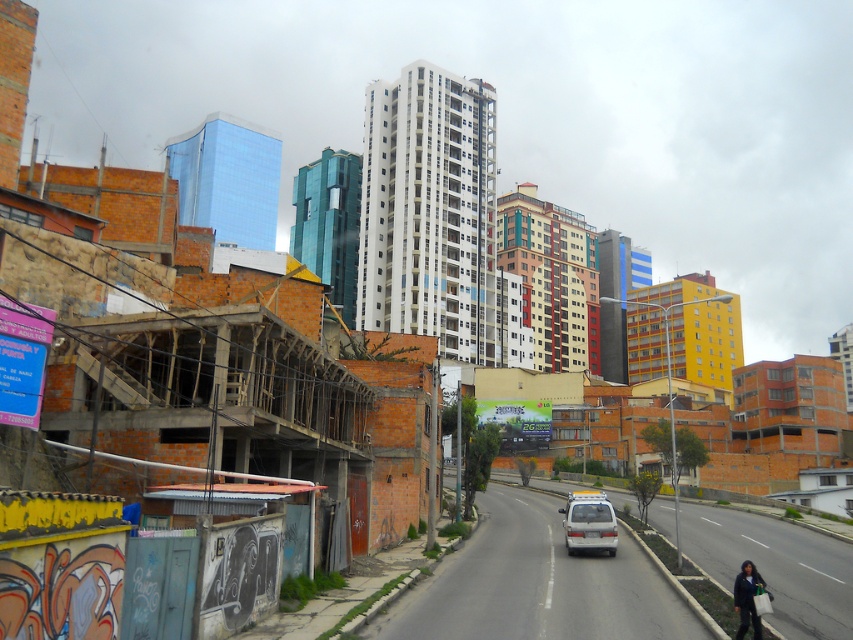
Question: Which point is closer to the camera taking this photo?

Choices:
 (A) (625, 547)
 (B) (747, 620)
 (C) (573, 548)

Answer: (B)

Question: Is white matte van at center above dark blue jacket at lower right?

Choices:
 (A) no
 (B) yes

Answer: (A)

Question: Which of the following is the closest to the observer?

Choices:
 (A) white matte van at center
 (B) dark blue jacket at lower right
 (C) gray asphalt road at center

Answer: (B)

Question: Does gray asphalt road at center lie behind dark blue jacket at lower right?

Choices:
 (A) yes
 (B) no

Answer: (A)

Question: Which object is farther from the camera taking this photo?

Choices:
 (A) white matte van at center
 (B) dark blue jacket at lower right

Answer: (A)

Question: From the image, what is the correct spatial relationship of gray asphalt road at center in relation to white matte van at center?

Choices:
 (A) right
 (B) left

Answer: (B)